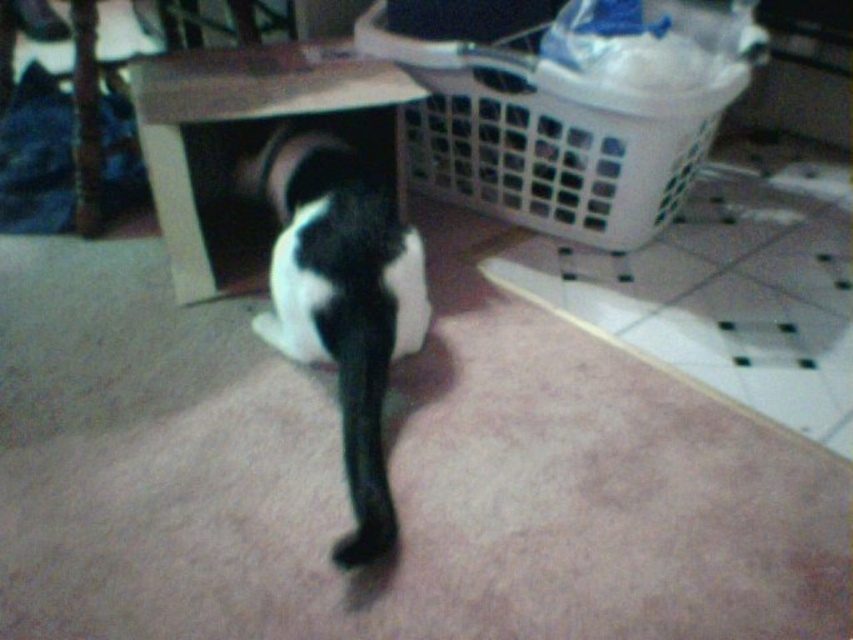
You are a delivery robot trying to navigate to the white plastic laundry basket at upper right. Your current position is at point A, which is located at coordinates 0.0, 0.0. The coordinate system has the origin at the bottom left corner of the image, with the x axis increasing to the right and the y axis increasing upwards. The point (547, 134) marks the location of the white plastic laundry basket at upper right. Can you determine the direction you need to move in to reach the white plastic laundry bask

The point (547, 134) marks the location of the white plastic laundry basket at upper right. Since the coordinate system has the origin at the bottom left corner, moving towards increasing x and y values will lead you to the basket. Therefore, you need to move northeast to reach the white plastic laundry basket at upper right.

You are a delivery robot positioned at the origin point in the room. The white plastic laundry basket at upper right is at coordinates 0.212, 0.642. If you need to deliver a package to the basket, which direction should you move first from your current position?

The white plastic laundry basket at upper right is located at point (547, 134). Since you are at the origin, you should move in the positive x and y directions to reach it.

Consider the image. You are standing in the room and see two points marked on the floor. The first point is at coordinates point [442,76] and the second point is at point [277,237]. Which point is closer to you?

Point [442,76] is closer to the viewer than point [277,237].